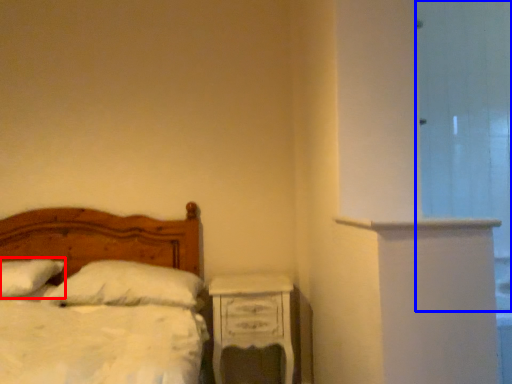
Question: Which object is closer to the camera taking this photo, pillow (highlighted by a red box) or glass door (highlighted by a blue box)?

Choices:
 (A) pillow
 (B) glass door

Answer: (B)